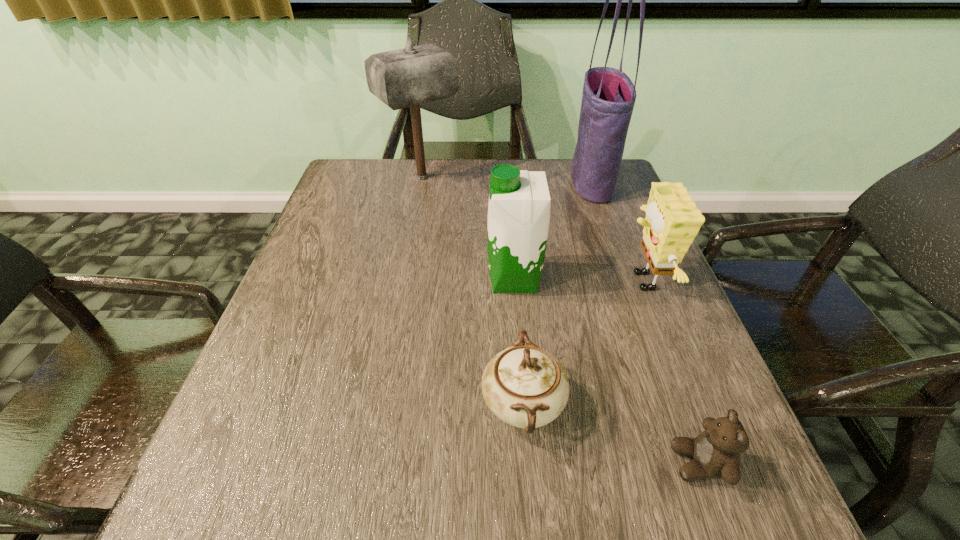
Locate an element on the screen. free point between the leftmost object and the chinaware is located at coordinates (472, 291).

I want to click on empty space between the soya milk and the tallest object, so click(553, 230).

Identify the location of blank region between the tallest object and the third shortest object. (616, 231).

Locate an element on the screen. the fourth closest object to the shortest object is located at coordinates (608, 99).

The width and height of the screenshot is (960, 540). I want to click on object that is the third closest one to the chinaware, so click(672, 221).

Where is `free spot that satisfies the following two spatial constraints: 1. on the back side of the chinaware; 2. on the right side of the tote bag`? free spot that satisfies the following two spatial constraints: 1. on the back side of the chinaware; 2. on the right side of the tote bag is located at coordinates (505, 180).